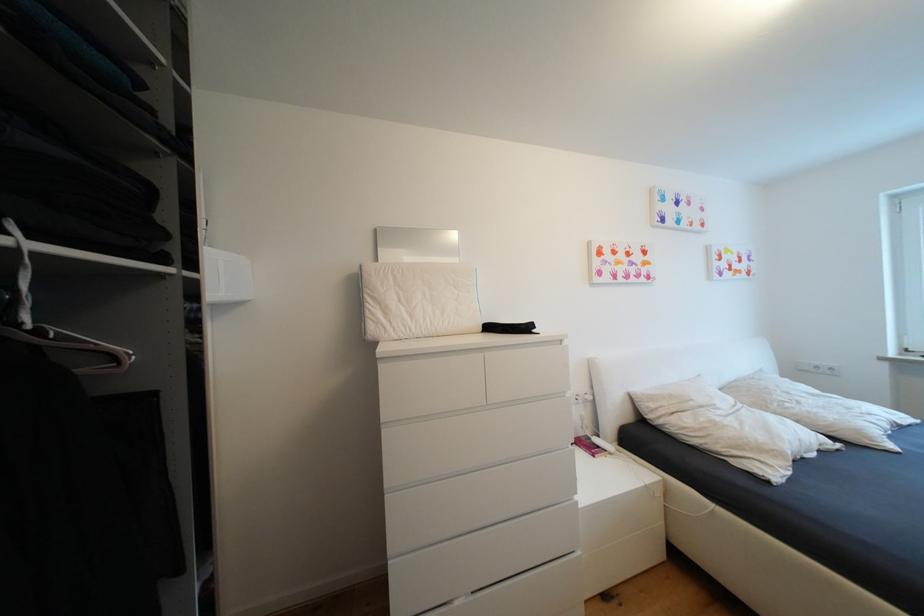
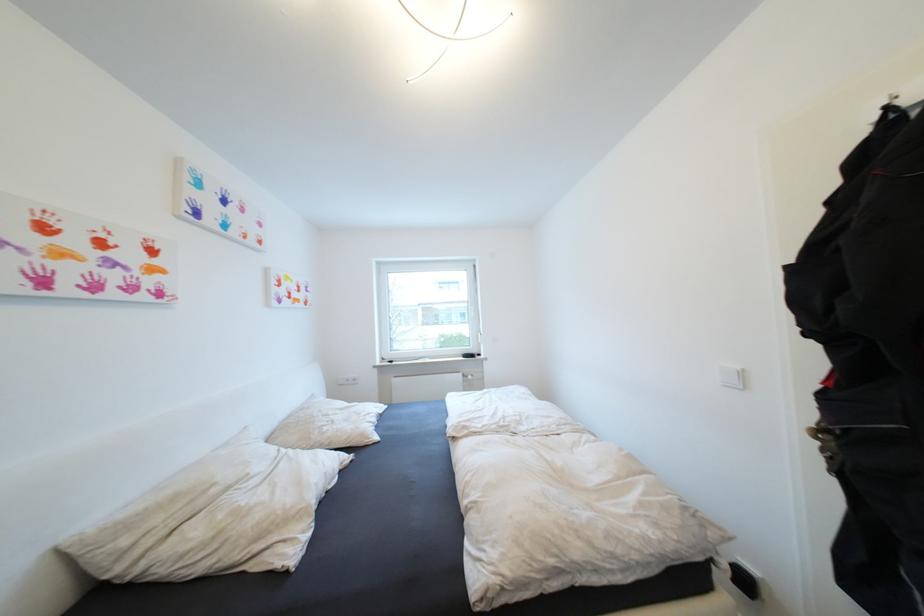
Question: Based on the continuous images, in which direction is the camera rotating? Reply with the corresponding letter.

Choices:
 (A) Left
 (B) Right
 (C) Up
 (D) Down

Answer: (B)